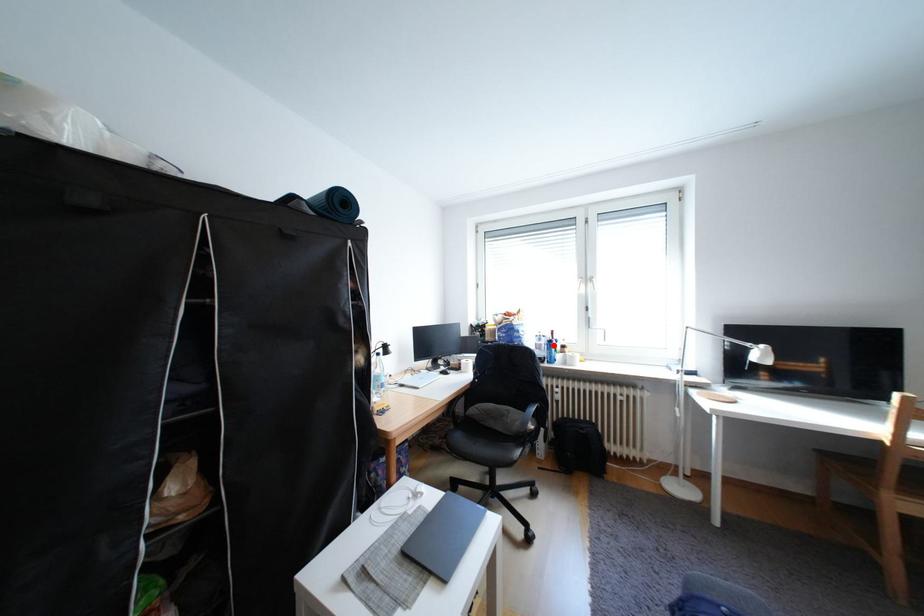
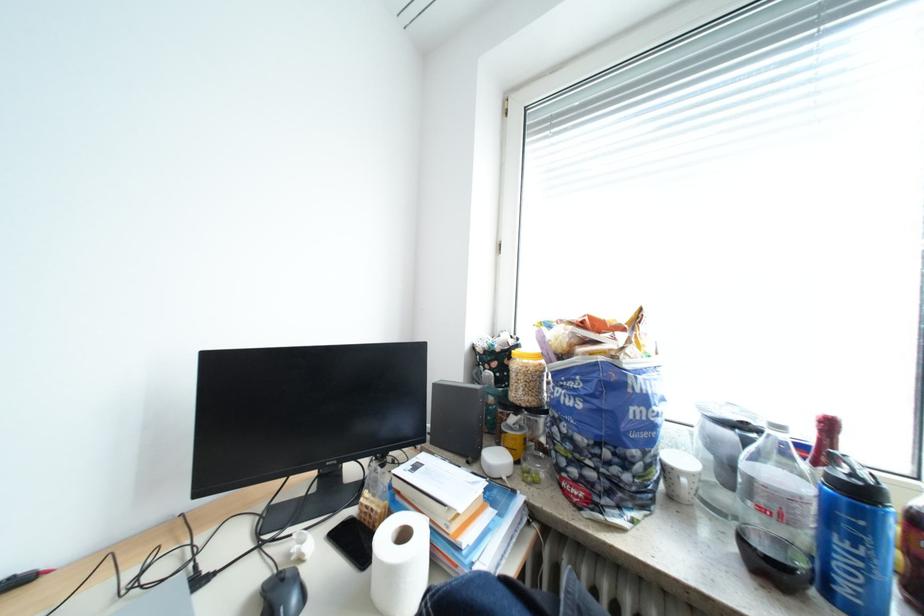
Question: I am providing you with two images of the same scene from different viewpoints. A red point is marked on the first image. Is the red point's position out of view in image 2?

Choices:
 (A) Yes
 (B) No

Answer: (B)